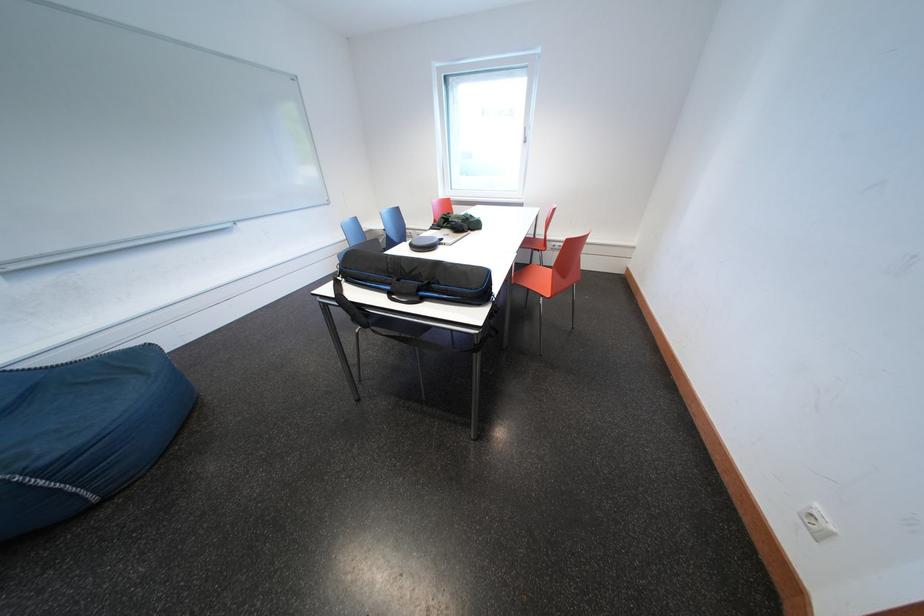
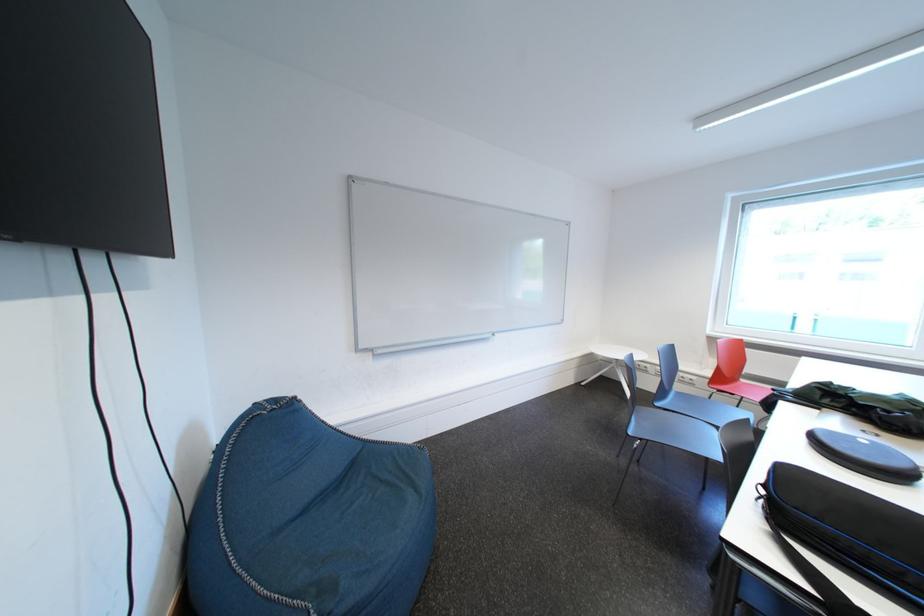
Locate, in the second image, the point that corresponds to (x=94, y=387) in the first image.

(390, 484)